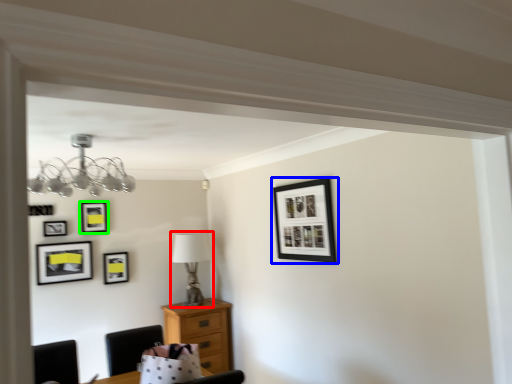
Question: Considering the real-world distances, which object is farthest from table lamp (highlighted by a red box)? picture frame (highlighted by a blue box) or picture frame (highlighted by a green box)?

Choices:
 (A) picture frame
 (B) picture frame

Answer: (A)